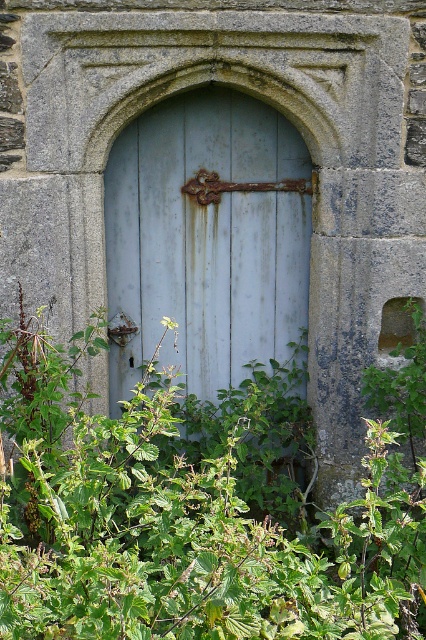
Question: Can you confirm if green leafy plant at center is wider than rusty metal door at center?

Choices:
 (A) yes
 (B) no

Answer: (A)

Question: Which point is closer to the camera?

Choices:
 (A) (146, 195)
 (B) (42, 369)

Answer: (B)

Question: Can you confirm if green leafy plant at center is positioned to the left of rusty metal door at center?

Choices:
 (A) no
 (B) yes

Answer: (A)

Question: Considering the relative positions of green leafy plant at center and rusty metal door at center in the image provided, where is green leafy plant at center located with respect to rusty metal door at center?

Choices:
 (A) above
 (B) below

Answer: (B)